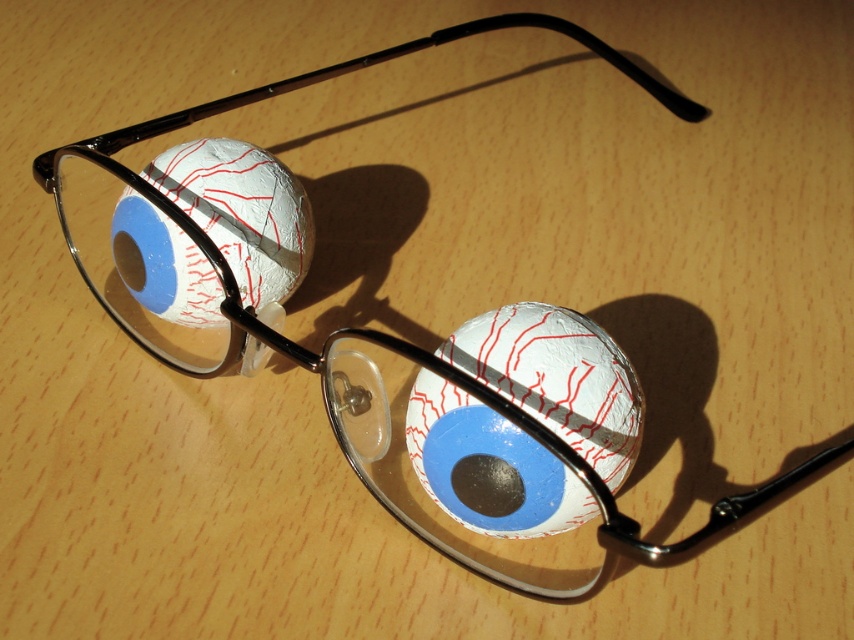
You are an artist trying to place a new element in the scene. You want to add a small sticker exactly at the point marked by point [557,378]. What object will the sticker overlap with when placed there?

The sticker placed at point [557,378] will overlap with the white crinkled paper eyeball at center.

You are organizing items on a table and need to place a new object between the white crinkled paper eyeball at center and the white crinkled baseball at left. Based on their positions, where should you place the new object relative to the eyeball?

The white crinkled paper eyeball at center is closer to the viewer than the white crinkled baseball at left, so you should place the new object between them by positioning it behind the eyeball and in front of the baseball.